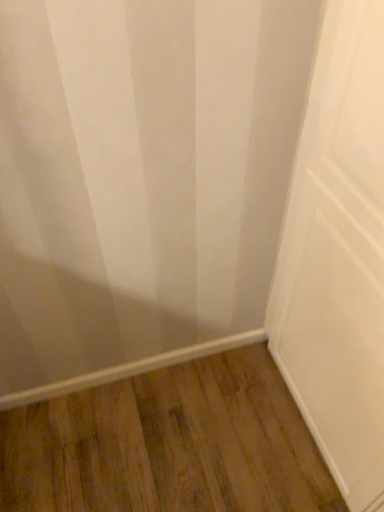
Identify the location of free location to the left of white matte door at center. (223, 425).